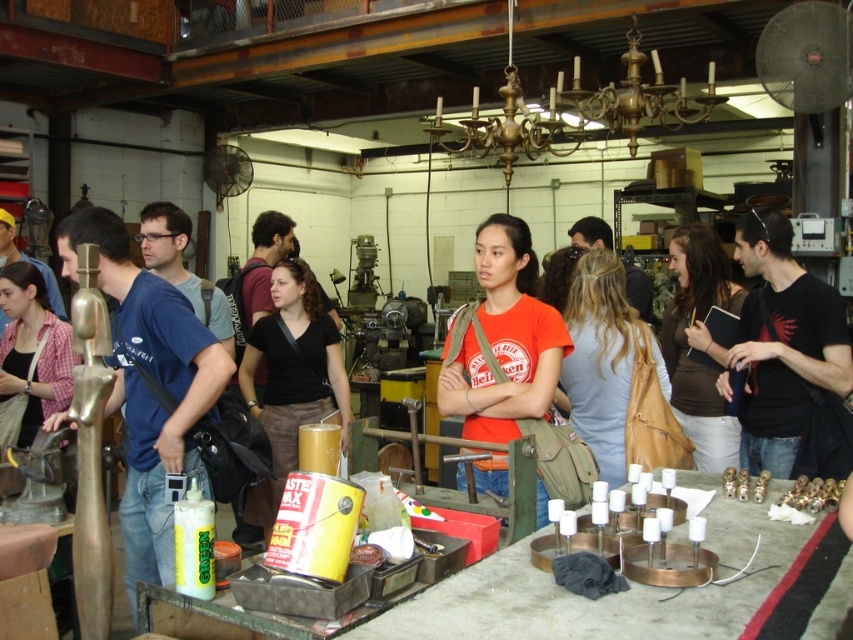
You are standing in the workshop and see two points marked on the wall. The first point is at coordinates point (773, 461) and the second is at point (704, 456). Which point is closer to you?

Point (773, 461) is closer to the viewer than point (704, 456).